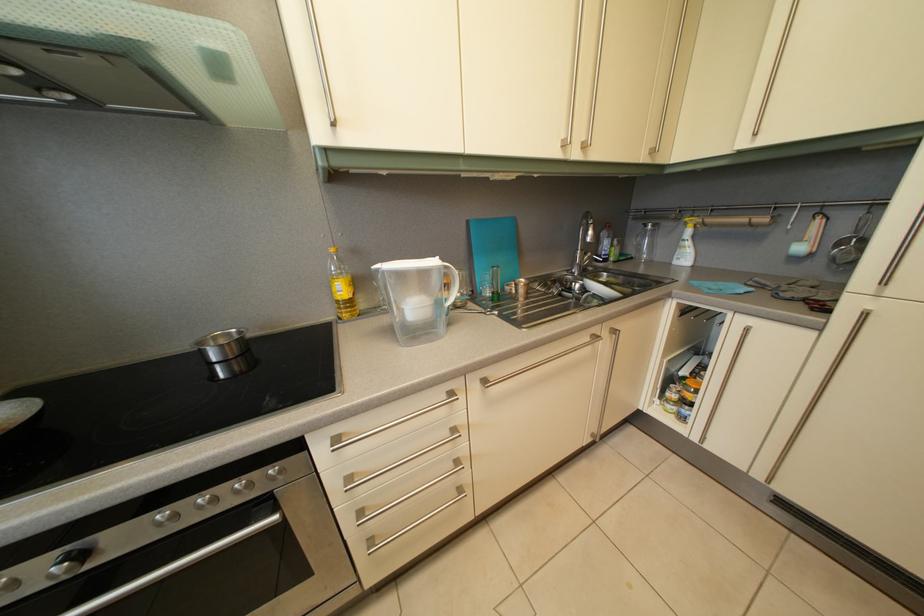
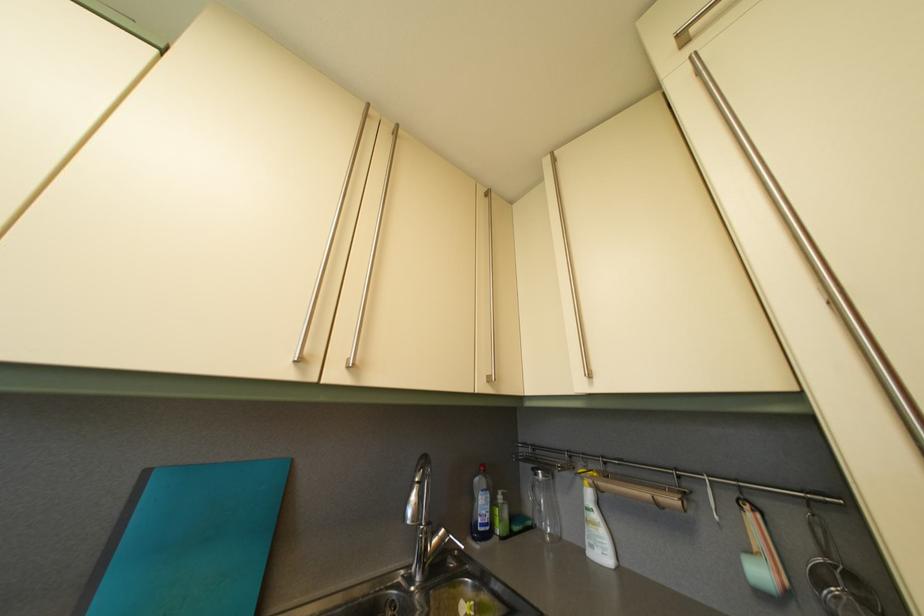
Question: How did the camera likely rotate?

Choices:
 (A) Left
 (B) Right
 (C) Up
 (D) Down

Answer: (C)